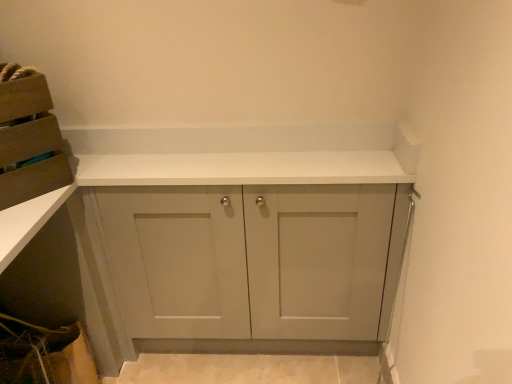
Question: Should I look upward or downward to see white matte cabinet at center, marked as the first cabinetry in a right-to-left arrangement?

Choices:
 (A) up
 (B) down

Answer: (B)

Question: Is white matte cabinet at center, positioned as the second cabinetry in left-to-right order, positioned with its back to matte cardboard box at upper left, placed as the 1th cabinetry when sorted from left to right?

Choices:
 (A) yes
 (B) no

Answer: (B)

Question: From a real-world perspective, is white matte cabinet at center, positioned as the second cabinetry in left-to-right order, on matte cardboard box at upper left, the 2th cabinetry from the right?

Choices:
 (A) no
 (B) yes

Answer: (A)

Question: Is the depth of white matte cabinet at center, positioned as the second cabinetry in left-to-right order, less than that of matte cardboard box at upper left, placed as the 1th cabinetry when sorted from left to right?

Choices:
 (A) no
 (B) yes

Answer: (A)

Question: Is white matte cabinet at center, positioned as the second cabinetry in left-to-right order, smaller than matte cardboard box at upper left, placed as the 1th cabinetry when sorted from left to right?

Choices:
 (A) no
 (B) yes

Answer: (A)

Question: Is white matte cabinet at center, marked as the first cabinetry in a right-to-left arrangement, in contact with matte cardboard box at upper left, placed as the 1th cabinetry when sorted from left to right?

Choices:
 (A) yes
 (B) no

Answer: (B)

Question: Can we say white matte cabinet at center, marked as the first cabinetry in a right-to-left arrangement, lies outside matte cardboard box at upper left, placed as the 1th cabinetry when sorted from left to right?

Choices:
 (A) yes
 (B) no

Answer: (A)

Question: Does matte cardboard box at upper left, the 2th cabinetry from the right, appear on the left side of white matte cabinet at center, marked as the first cabinetry in a right-to-left arrangement?

Choices:
 (A) no
 (B) yes

Answer: (B)

Question: From the image's perspective, is matte cardboard box at upper left, placed as the 1th cabinetry when sorted from left to right, under white matte cabinet at center, marked as the first cabinetry in a right-to-left arrangement?

Choices:
 (A) no
 (B) yes

Answer: (A)

Question: Is matte cardboard box at upper left, the 2th cabinetry from the right, further to the viewer compared to white matte cabinet at center, marked as the first cabinetry in a right-to-left arrangement?

Choices:
 (A) no
 (B) yes

Answer: (A)

Question: Can you confirm if matte cardboard box at upper left, the 2th cabinetry from the right, is thinner than white matte cabinet at center, marked as the first cabinetry in a right-to-left arrangement?

Choices:
 (A) no
 (B) yes

Answer: (A)

Question: Is matte cardboard box at upper left, the 2th cabinetry from the right, closer to the viewer compared to white matte cabinet at center, marked as the first cabinetry in a right-to-left arrangement?

Choices:
 (A) yes
 (B) no

Answer: (A)

Question: From a real-world perspective, is matte cardboard box at upper left, placed as the 1th cabinetry when sorted from left to right, physically above white matte cabinet at center, marked as the first cabinetry in a right-to-left arrangement?

Choices:
 (A) yes
 (B) no

Answer: (A)

Question: From a real-world perspective, relative to white matte cabinet at center, marked as the first cabinetry in a right-to-left arrangement, is matte cardboard box at upper left, the 2th cabinetry from the right, vertically above or below?

Choices:
 (A) above
 (B) below

Answer: (A)